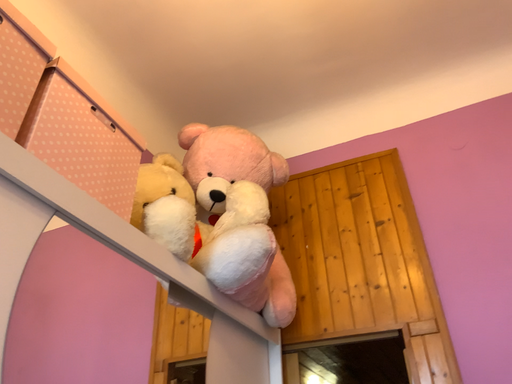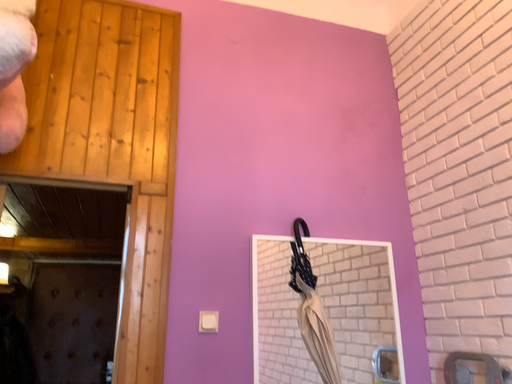
Question: How did the camera likely rotate when shooting the video?

Choices:
 (A) rotated left
 (B) rotated right

Answer: (B)